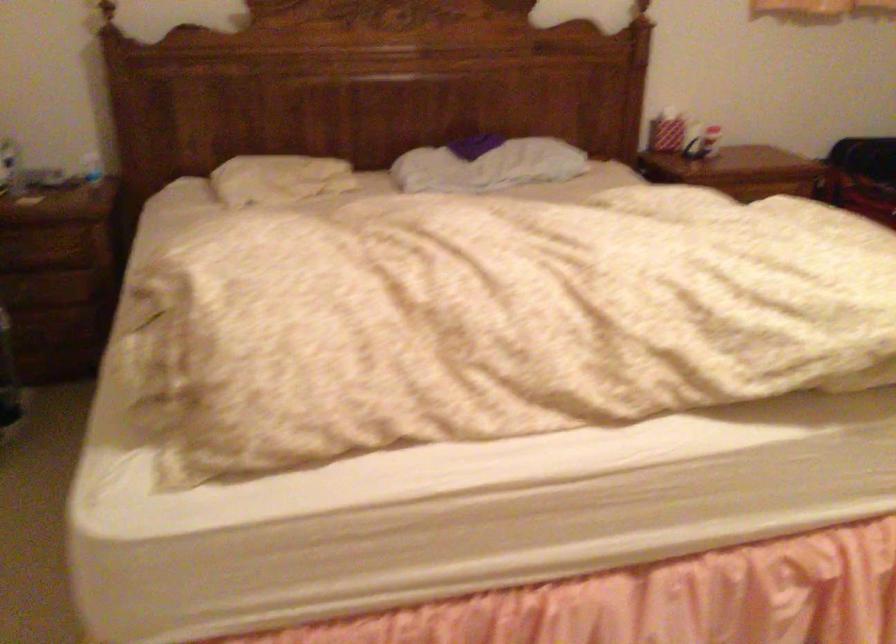
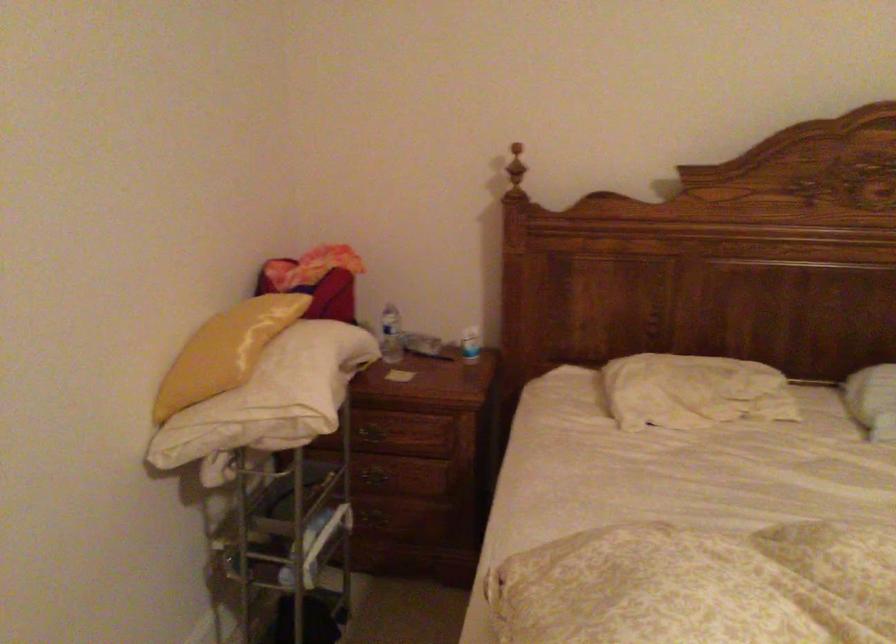
Find the pixel in the second image that matches pixel 91 169 in the first image.

(470, 344)